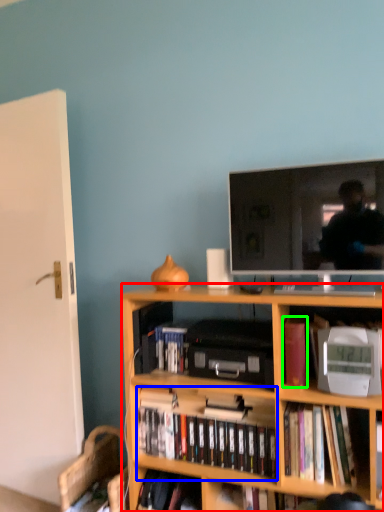
Question: Based on their relative distances, which object is farther from bookcase (highlighted by a red box)? Choose from book (highlighted by a blue box) and book (highlighted by a green box).

Choices:
 (A) book
 (B) book

Answer: (B)